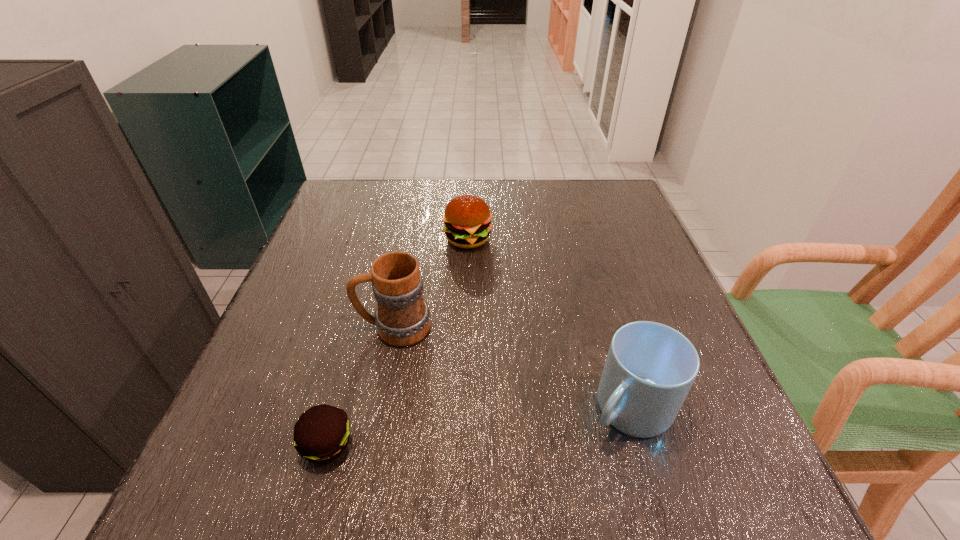
Locate an element on the screen. object that stands as the third closest to the farther mug is located at coordinates (650, 368).

At what (x,y) coordinates should I click in order to perform the action: click on free location that satisfies the following two spatial constraints: 1. on the side of the third nearest object with the handle; 2. on the right side of the rightmost object. Please return your answer as a coordinate pair (x, y). Looking at the image, I should click on (377, 409).

The height and width of the screenshot is (540, 960). Identify the location of free location that satisfies the following two spatial constraints: 1. on the front side of the hamburger; 2. on the side of the third nearest object with the handle. (465, 327).

Image resolution: width=960 pixels, height=540 pixels. I want to click on free region that satisfies the following two spatial constraints: 1. on the side of the left mug with the handle; 2. on the right side of the nearer mug, so click(377, 409).

The image size is (960, 540). I want to click on free point that satisfies the following two spatial constraints: 1. on the back side of the rightmost object; 2. on the side of the left mug with the handle, so click(x=606, y=327).

The image size is (960, 540). I want to click on free location that satisfies the following two spatial constraints: 1. on the back side of the hamburger; 2. on the left side of the shortest object, so click(384, 239).